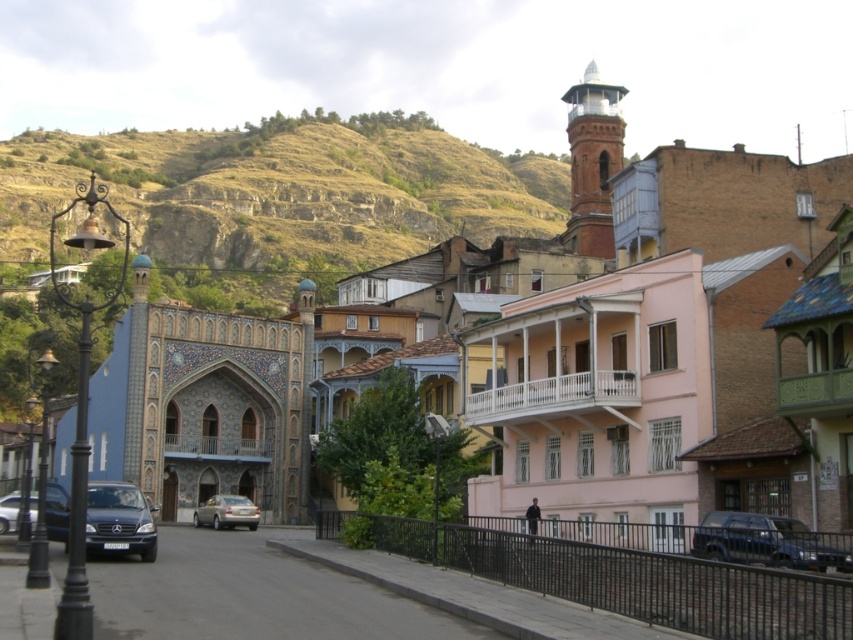
Question: Among these points, which one is farthest from the camera?

Choices:
 (A) (281, 284)
 (B) (33, 512)

Answer: (A)

Question: Is metallic gray sedan at lower right thinner than shiny black sedan at lower left?

Choices:
 (A) yes
 (B) no

Answer: (A)

Question: Which of the following is the farthest from the observer?

Choices:
 (A) (0, 524)
 (B) (393, 161)

Answer: (B)

Question: Which object is positioned closest to the rustic stone hillside at upper left?

Choices:
 (A) silver metallic car at center
 (B) shiny black sedan at lower left

Answer: (A)

Question: Does shiny black car at center have a larger size compared to shiny black sedan at lower left?

Choices:
 (A) yes
 (B) no

Answer: (B)

Question: Can you confirm if rustic stone hillside at upper left is positioned to the right of shiny black car at center?

Choices:
 (A) yes
 (B) no

Answer: (B)